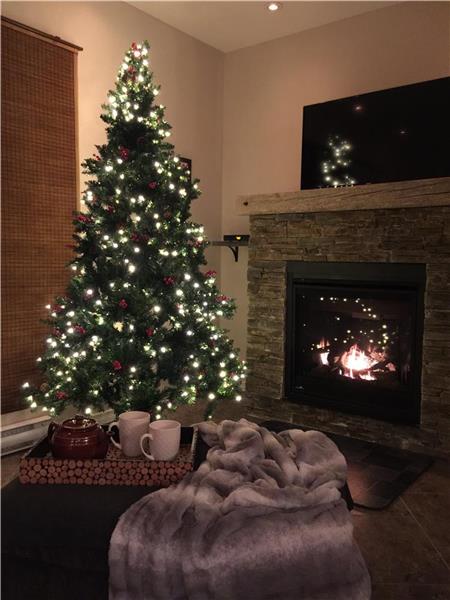
Where is `tea kettle`? Image resolution: width=450 pixels, height=600 pixels. tea kettle is located at coordinates (76, 435).